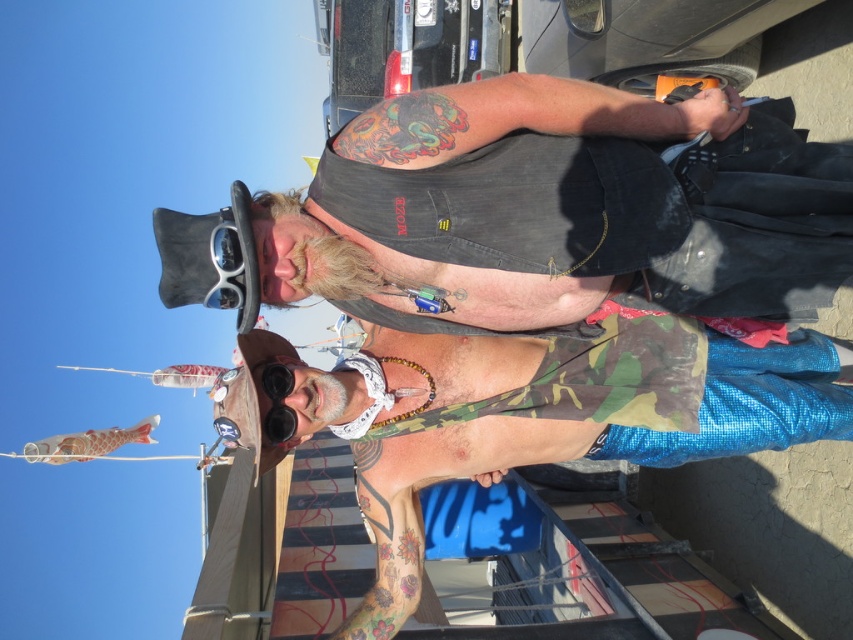
Is point (573, 81) positioned in front of point (281, 412)?

Yes, it is in front of point (281, 412).

The width and height of the screenshot is (853, 640). Describe the element at coordinates (555, 211) in the screenshot. I see `denim vest at center` at that location.

Locate an element on the screen. Image resolution: width=853 pixels, height=640 pixels. denim vest at center is located at coordinates 555,211.

Is point (627, 288) positioned in front of point (358, 396)?

Yes, it is in front of point (358, 396).

Does point (732, 129) come behind point (434, 461)?

No, (732, 129) is in front of (434, 461).

The height and width of the screenshot is (640, 853). In order to click on denim vest at center in this screenshot , I will do `click(555, 211)`.

Is denim vest at center to the right of white plastic goggles at upper center from the viewer's perspective?

Indeed, denim vest at center is positioned on the right side of white plastic goggles at upper center.

Is denim vest at center bigger than white plastic goggles at upper center?

Correct, denim vest at center is larger in size than white plastic goggles at upper center.

Image resolution: width=853 pixels, height=640 pixels. I want to click on denim vest at center, so (555, 211).

Locate an element on the screen. denim vest at center is located at coordinates pos(555,211).